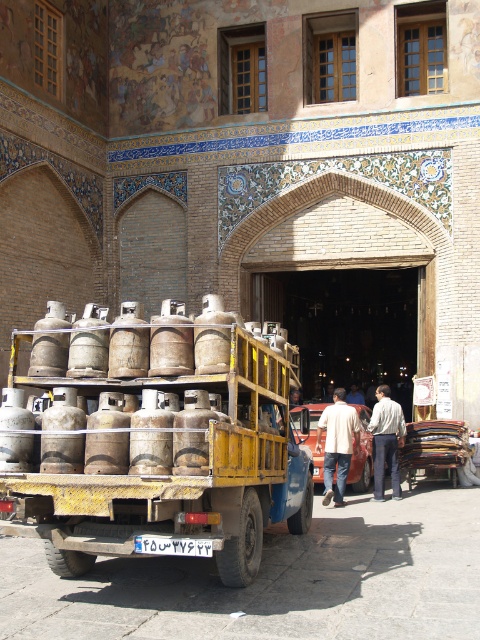
Question: Which of the following is the farthest from the observer?

Choices:
 (A) (328, 461)
 (B) (240, 378)
 (C) (386, 419)

Answer: (C)

Question: Which point is farther to the camera?

Choices:
 (A) light beige fabric shirt at center
 (B) light beige sweater at center

Answer: (B)

Question: Is rusty metal truck at center to the right of light beige sweater at center from the viewer's perspective?

Choices:
 (A) yes
 (B) no

Answer: (B)

Question: Does light beige fabric shirt at center lie behind light beige sweater at center?

Choices:
 (A) yes
 (B) no

Answer: (B)

Question: Based on their relative distances, which object is nearer to the light beige sweater at center?

Choices:
 (A) light beige fabric shirt at center
 (B) rusty metal truck at center

Answer: (A)

Question: Does rusty metal truck at center appear over light beige fabric shirt at center?

Choices:
 (A) yes
 (B) no

Answer: (A)